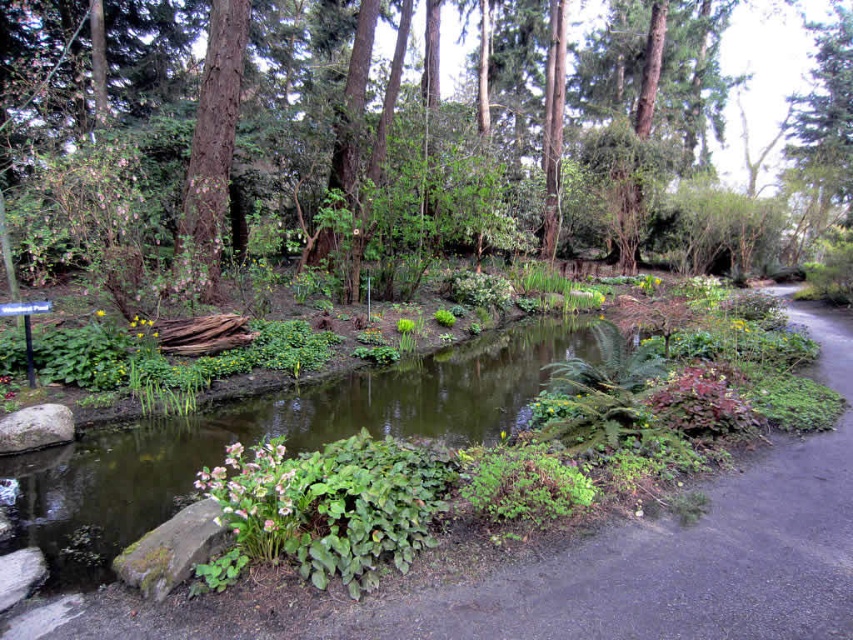
You are standing at the entrance of the garden and see the green leafy path at center and the green leafy stream at center. Which one is located to the right when facing the garden?

The green leafy path at center is located to the right of the green leafy stream at center.

You are standing at the entrance of the garden and want to reach the green leafy path at center. According to the coordinates provided, in which direction should you walk from your current position to reach it?

The green leafy path at center is located at coordinates 0.867 on the x axis and 0.795 on the y axis. Since you are at the entrance, which is likely at the lower left corner of the image, you should walk towards the upper right direction to reach it.

You are a gardener planning to place a decorative stone between the green leafy stream at center and the white matte flower at center. Based on their positions, which object should the stone be closer to?

The stone should be placed closer to the white matte flower at center because the green leafy stream at center is positioned on the right side of the white matte flower at center, meaning the flower is to the left of the stream. Therefore, placing the stone between them would require it to be closer to the flower to maintain symmetry or balance.